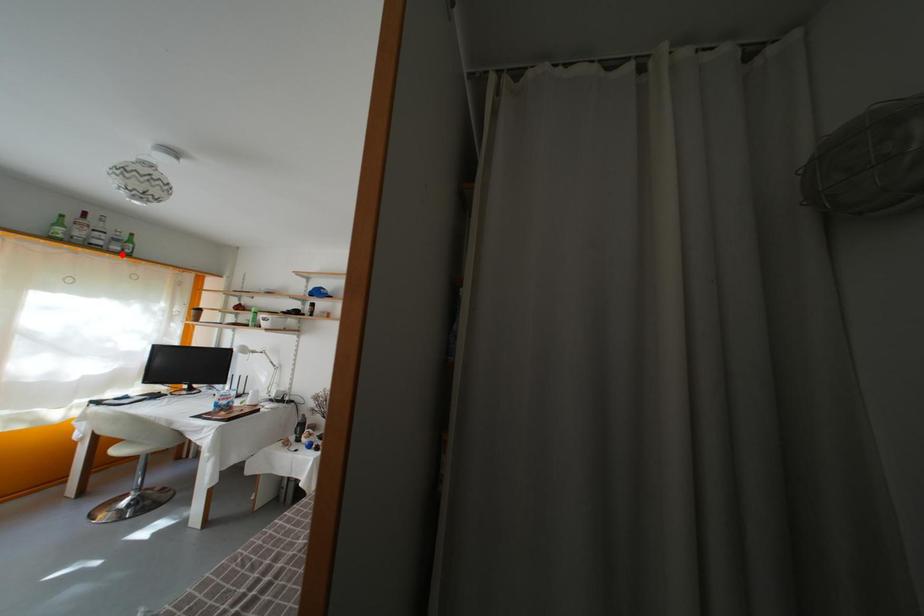
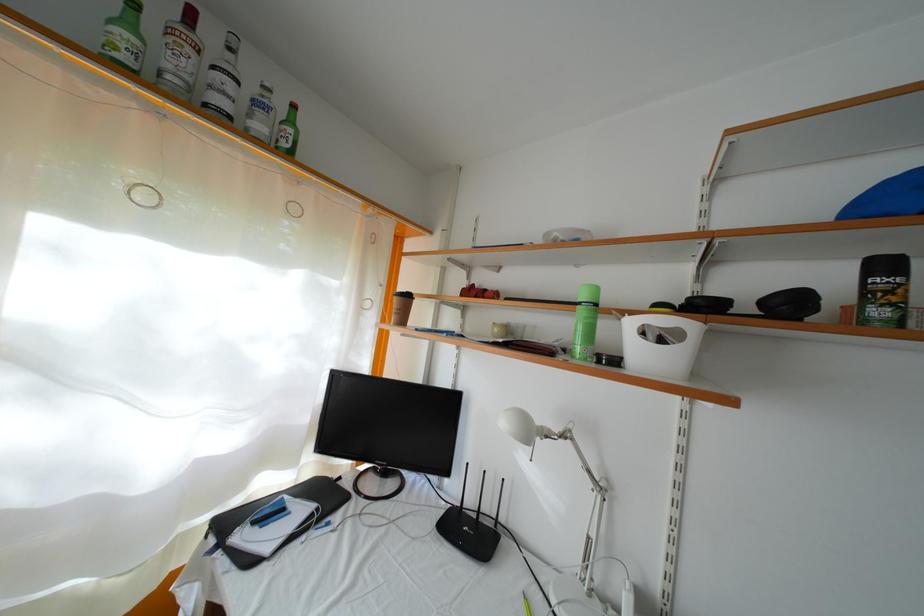
The point at the highlighted location is marked in the first image. Where is the corresponding point in the second image?

(264, 134)